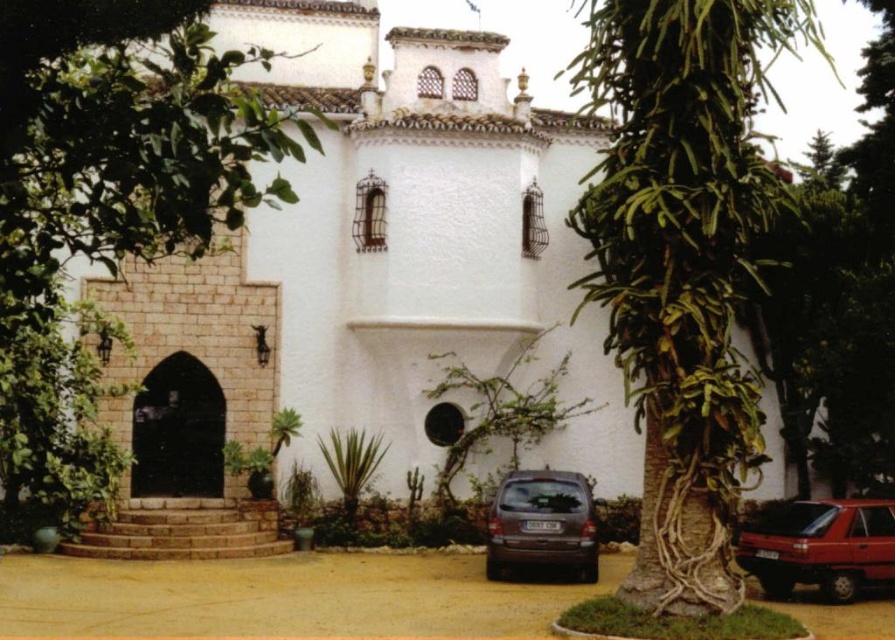
Question: Which object is positioned farthest from the green leafy tree at center?

Choices:
 (A) satin brown minivan at lower center
 (B) green leafy tree at left

Answer: (B)

Question: Among these objects, which one is farthest from the camera?

Choices:
 (A) shiny red car at lower right
 (B) green leafy tree at center
 (C) green leafy tree at left

Answer: (A)

Question: Does shiny red car at lower right come in front of satin brown minivan at lower center?

Choices:
 (A) no
 (B) yes

Answer: (B)

Question: Which point is closer to the camera taking this photo?

Choices:
 (A) 858,589
 (B) 555,544

Answer: (A)

Question: Can you confirm if green leafy tree at center is positioned below satin brown minivan at lower center?

Choices:
 (A) no
 (B) yes

Answer: (A)

Question: Is green leafy tree at left to the left of satin brown minivan at lower center from the viewer's perspective?

Choices:
 (A) no
 (B) yes

Answer: (B)